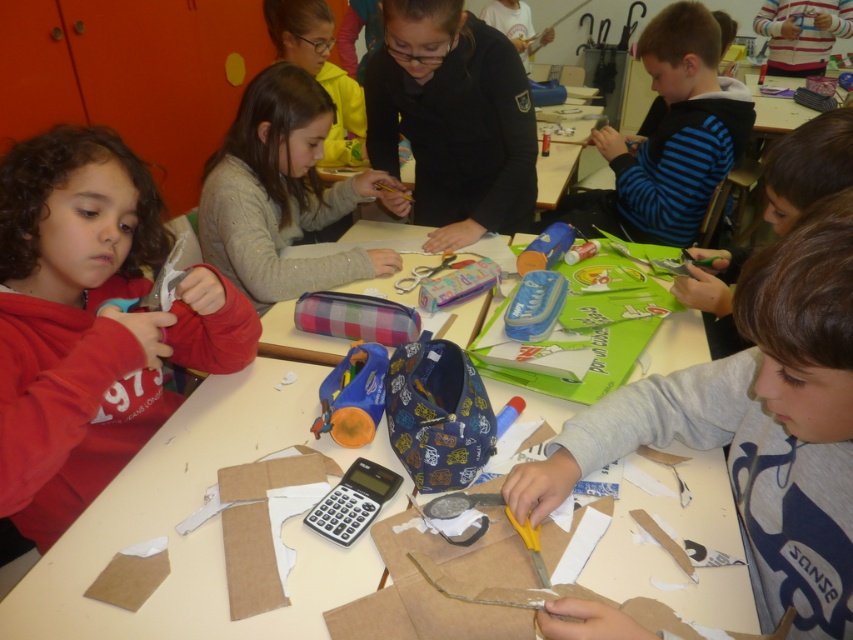
Based on the photo, you are a teacher observing the classroom. You notice the blue striped sweater at upper right and the dark blue fabric at upper right on the table. Which object is positioned higher up on the table?

The blue striped sweater at upper right is taller than the dark blue fabric at upper right, so the blue striped sweater at upper right is positioned higher up on the table.

You are a student in the classroom and need to reach the gray fabric scissors at right for your project. Considering the distance between you and the scissors, can you comfortably extend your arm to grab them without moving your chair?

The gray fabric scissors at right are 23.38 inches away from you. Since the average arm length for a student is about 22 inches, you might need to stretch a bit but it should be possible to reach them without moving your chair.

You are a teacher observing the classroom and want to locate two specific points on the table where materials are placed. The first point is at coordinates point (x=622, y=140) and the second is at point (x=691, y=248). Which of these two points is closer to you as the teacher standing at the front of the classroom?

Point (x=622, y=140) is closer to you because it is further to the viewer than point (x=691, y=248).